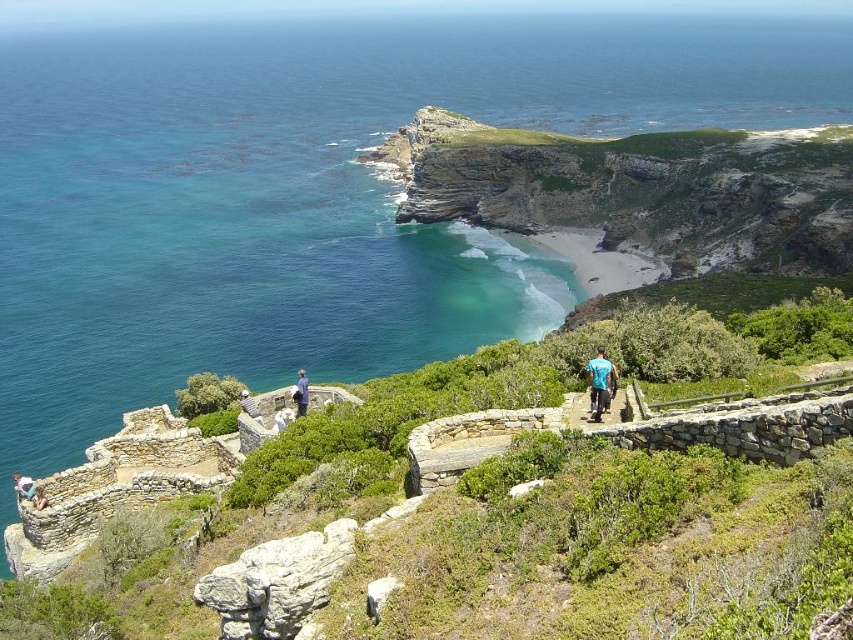
You are a hiker who has reached the viewing platform overlooking the cove. You notice a blue fabric shirt at center. Based on its coordinates, where would you find it relative to your current position?

The blue fabric shirt at center is located at coordinates point [300,392], which places it slightly to the right and above your current position on the viewing platform.

You are a photographer planning to capture a photo of a person wearing a blue fabric shirt at center and blue denim jeans at lower left. Which clothing item would appear narrower in the final image?

The blue fabric shirt at center would appear narrower in the final image because it has a lesser width compared to the blue denim jeans at lower left.

You are standing at the top of the cliff overlooking the coastal landscape. You see a blue fabric shirt at center and a light blue fabric at center. If you want to reach both items, which one should you head towards first if you want to collect the closest one to you?

The blue fabric shirt at center is 10.75 meters away from the light blue fabric at center. Since you want to collect the closest item first, you should head towards whichever is nearer to your current position. However, the description only provides the distance between the two items, not their individual distances from you. Without knowing their exact positions relative to your vantage point, it is impossible to determine which is closer.